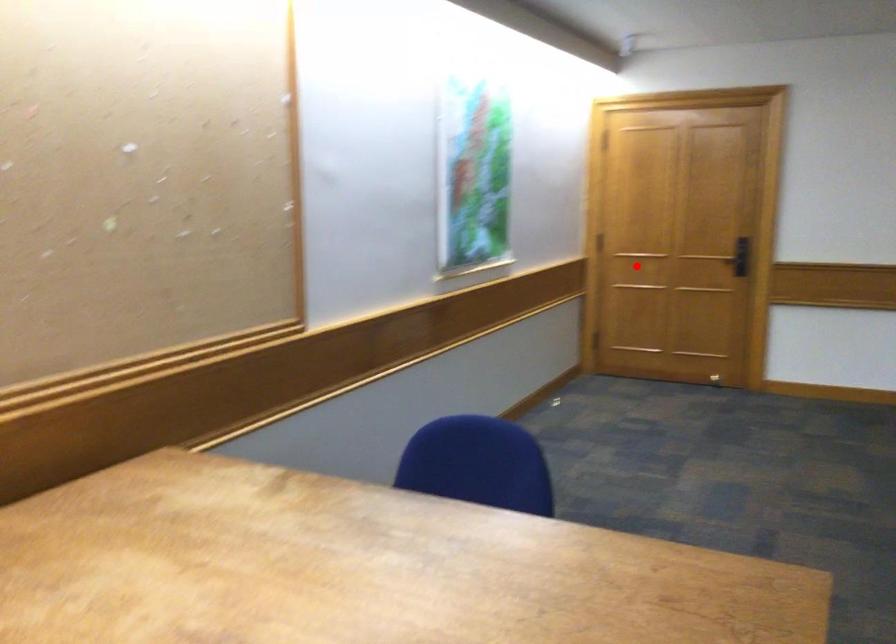
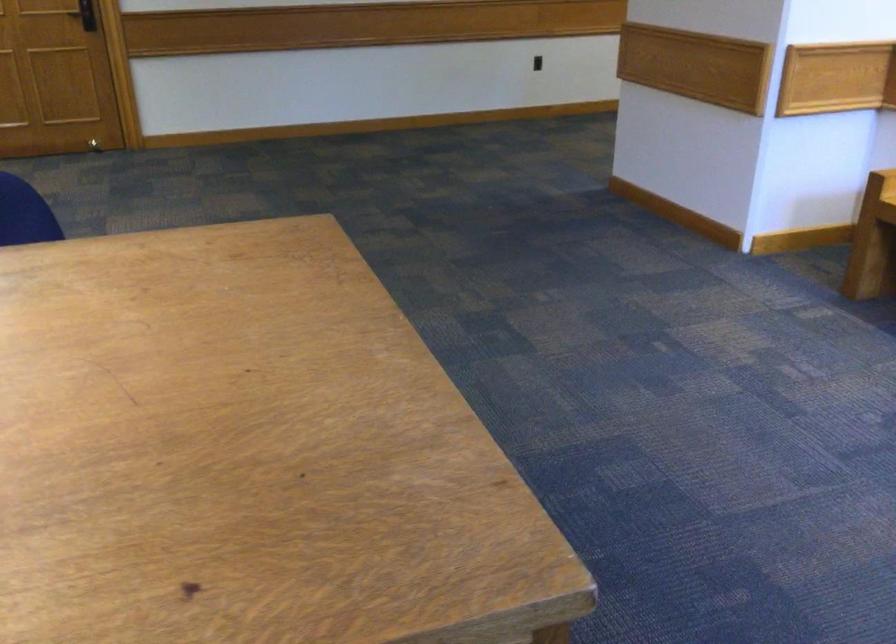
The point at the highlighted location is marked in the first image. Where is the corresponding point in the second image?

(85, 15)